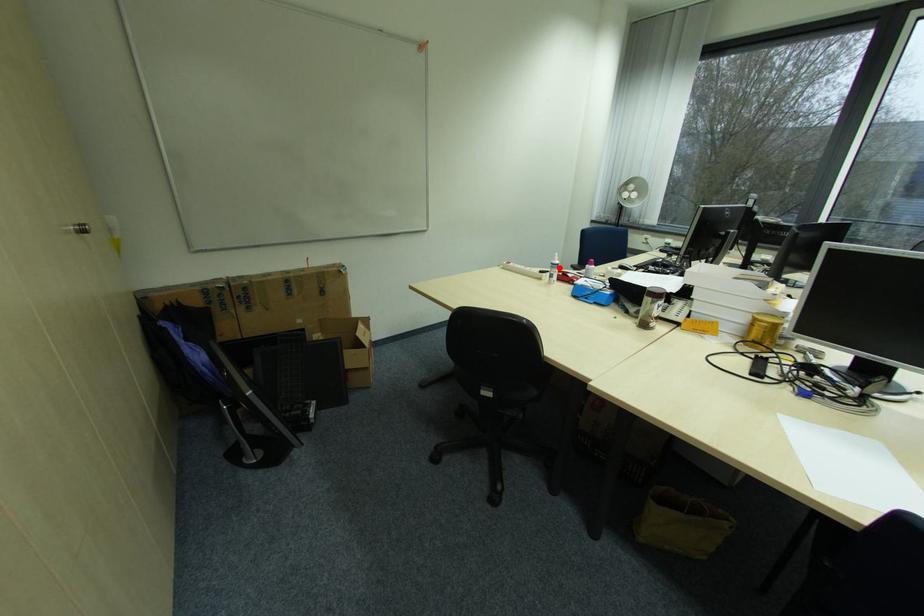
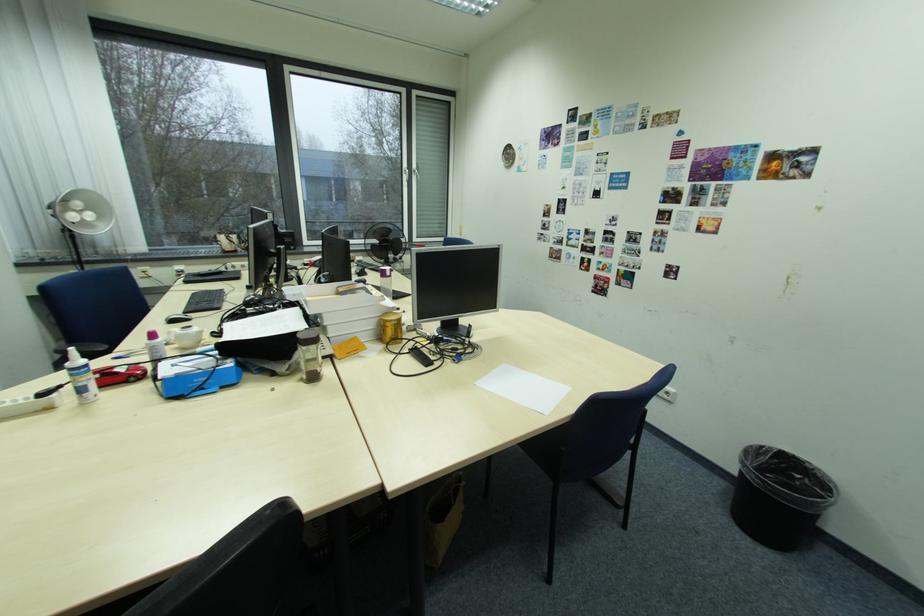
Where in the second image is the point corresponding to the highlighted location from the first image?

(80, 376)